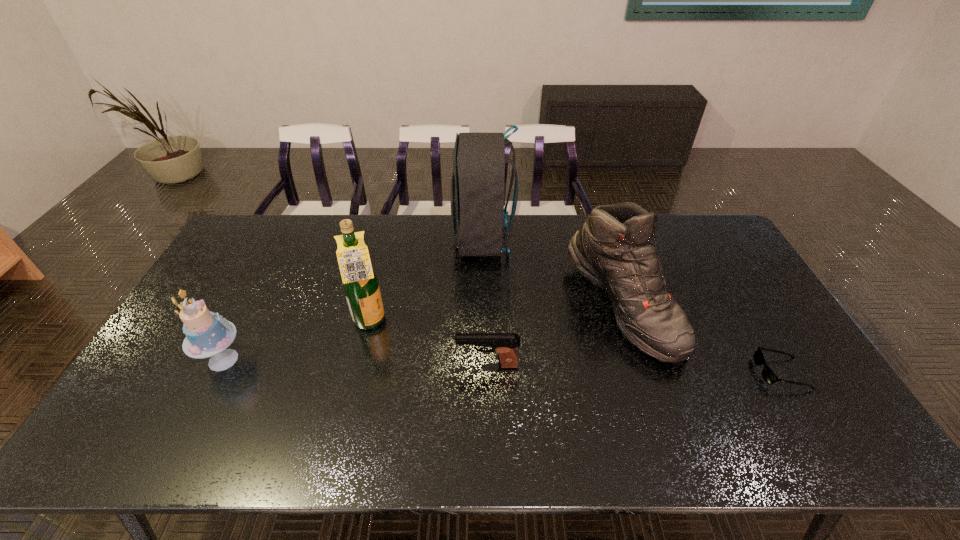
You are a GUI agent. You are given a task and a screenshot of the screen. Output one action in this format:
    pyautogui.click(x=<x>, y=<y>)
    Task: Click on the tallest object
    
    Given the screenshot: What is the action you would take?
    pyautogui.click(x=478, y=180)

Where is `liquor`? liquor is located at coordinates (360, 283).

Identify the location of ski boot. (614, 249).

This screenshot has height=540, width=960. I want to click on the leftmost object, so click(207, 334).

What are the coordinates of `cake` in the screenshot? It's located at (207, 334).

The image size is (960, 540). I want to click on pistol, so click(x=503, y=344).

Where is `the shortest object`? This screenshot has width=960, height=540. the shortest object is located at coordinates (768, 375).

Where is `the rightmost object`? the rightmost object is located at coordinates (768, 375).

Where is `free space located 0.190m on the front-facing side of the tallest object`? The width and height of the screenshot is (960, 540). free space located 0.190m on the front-facing side of the tallest object is located at coordinates (399, 240).

Where is `vacant point located 0.230m on the front-facing side of the tallest object`? vacant point located 0.230m on the front-facing side of the tallest object is located at coordinates (389, 240).